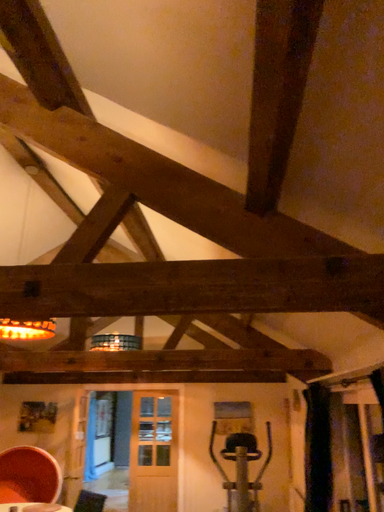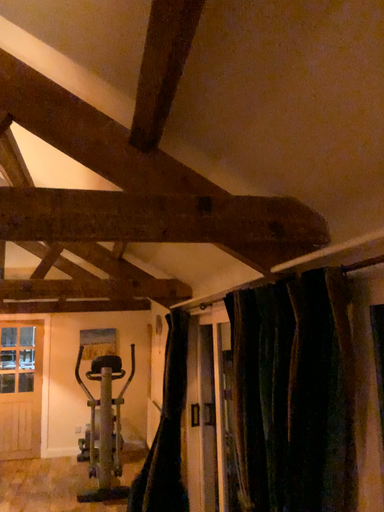
Question: How did the camera likely rotate when shooting the video?

Choices:
 (A) rotated upward
 (B) rotated downward

Answer: (B)